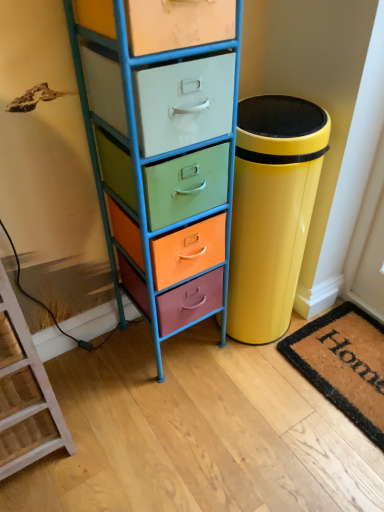
The width and height of the screenshot is (384, 512). What are the coordinates of `vacant area that lies between wooden ladder at lower left and coir doormat at lower right` in the screenshot? It's located at (180, 419).